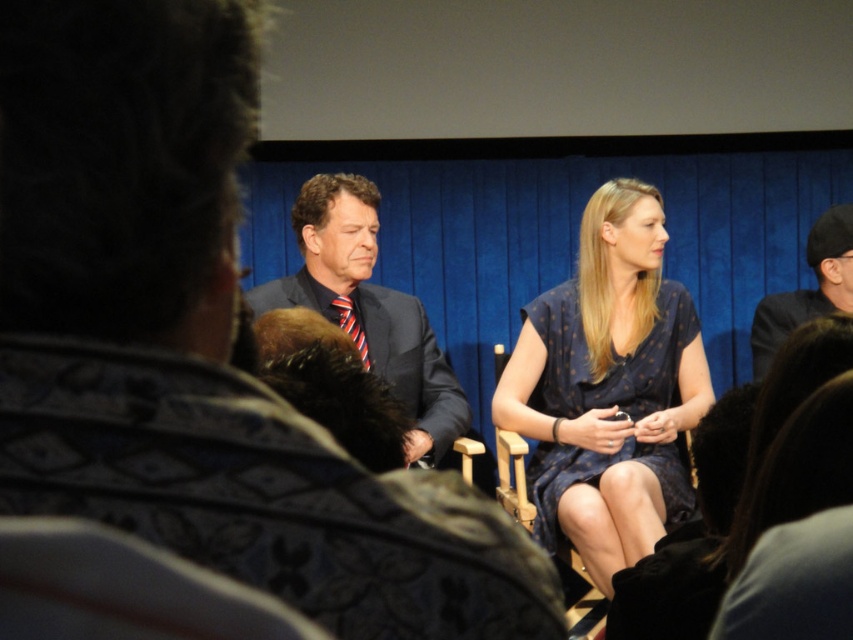
Between point (62, 426) and point (582, 596), which one is positioned behind?

Positioned behind is point (582, 596).

Does dark blue suit at center appear on the right side of wooden chair at center?

No, dark blue suit at center is not to the right of wooden chair at center.

Who is more distant from viewer, (x=337, y=589) or (x=500, y=362)?

The point (x=500, y=362) is more distant.

Identify the location of dark blue suit at center. (196, 342).

Can you confirm if blue dotted dress at center is bigger than matte black suit at left?

Yes.

This screenshot has height=640, width=853. What do you see at coordinates (608, 388) in the screenshot?
I see `blue dotted dress at center` at bounding box center [608, 388].

Identify the location of blue dotted dress at center. (608, 388).

Locate an element on the screen. Image resolution: width=853 pixels, height=640 pixels. blue dotted dress at center is located at coordinates (608, 388).

Consider the image. Between blue dotted dress at center and wooden chair at center, which one appears on the left side from the viewer's perspective?

Positioned to the left is wooden chair at center.

Does point (579, 456) lie behind point (567, 589)?

No, (579, 456) is closer to viewer.

You are a GUI agent. You are given a task and a screenshot of the screen. Output one action in this format:
    pyautogui.click(x=<x>, y=<y>)
    Task: Click on the blue dotted dress at center
    
    Given the screenshot: What is the action you would take?
    pyautogui.click(x=608, y=388)